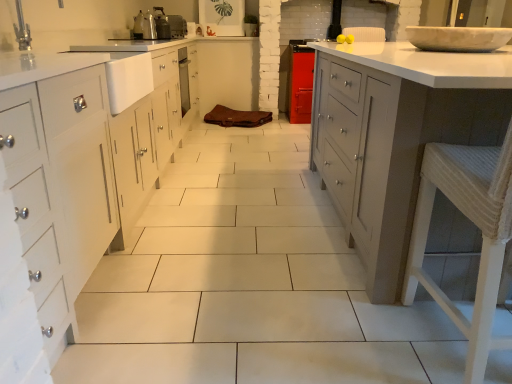
Question: Can you confirm if metallic silver toaster at upper center, acting as the 2th appliance starting from the front, is taller than white glossy countertop at right?

Choices:
 (A) yes
 (B) no

Answer: (B)

Question: From a real-world perspective, is metallic silver toaster at upper center, which is counted as the second appliance, starting from the bottom, positioned over white glossy countertop at right based on gravity?

Choices:
 (A) no
 (B) yes

Answer: (B)

Question: Would you say metallic silver toaster at upper center, which is counted as the second appliance, starting from the bottom, is outside white glossy countertop at right?

Choices:
 (A) yes
 (B) no

Answer: (A)

Question: Is metallic silver toaster at upper center, the 1th appliance when ordered from top to bottom, bigger than white glossy countertop at right?

Choices:
 (A) yes
 (B) no

Answer: (B)

Question: Is metallic silver toaster at upper center, which ranks as the 1th appliance in back-to-front order, aimed at white glossy countertop at right?

Choices:
 (A) yes
 (B) no

Answer: (A)

Question: Does metallic silver toaster at upper center, which ranks as the 1th appliance in back-to-front order, lie behind white glossy countertop at right?

Choices:
 (A) no
 (B) yes

Answer: (B)

Question: Is metallic silver toaster at upper center, which is counted as the second appliance, starting from the bottom, at the left side of metallic silver toaster at upper center, positioned as the 2th appliance in back-to-front order?

Choices:
 (A) no
 (B) yes

Answer: (A)

Question: From a real-world perspective, is metallic silver toaster at upper center, which is counted as the second appliance, starting from the bottom, located higher than metallic silver toaster at upper center, which is the 2th appliance in top-to-bottom order?

Choices:
 (A) no
 (B) yes

Answer: (A)

Question: Is metallic silver toaster at upper center, which ranks as the 1th appliance in back-to-front order, taller than metallic silver toaster at upper center, which ranks as the first appliance in bottom-to-top order?

Choices:
 (A) yes
 (B) no

Answer: (B)

Question: Is metallic silver toaster at upper center, acting as the 2th appliance starting from the front, thinner than metallic silver toaster at upper center, positioned as the 2th appliance in back-to-front order?

Choices:
 (A) no
 (B) yes

Answer: (A)

Question: From the image's perspective, is metallic silver toaster at upper center, which ranks as the 1th appliance in back-to-front order, over metallic silver toaster at upper center, positioned as the 2th appliance in back-to-front order?

Choices:
 (A) yes
 (B) no

Answer: (A)

Question: Could you tell me if metallic silver toaster at upper center, which is counted as the second appliance, starting from the bottom, is turned towards metallic silver toaster at upper center, which is the 2th appliance in top-to-bottom order?

Choices:
 (A) no
 (B) yes

Answer: (A)

Question: Is metallic silver toaster at upper center, which is the 2th appliance in top-to-bottom order, located outside white marble bowl at upper right?

Choices:
 (A) yes
 (B) no

Answer: (A)